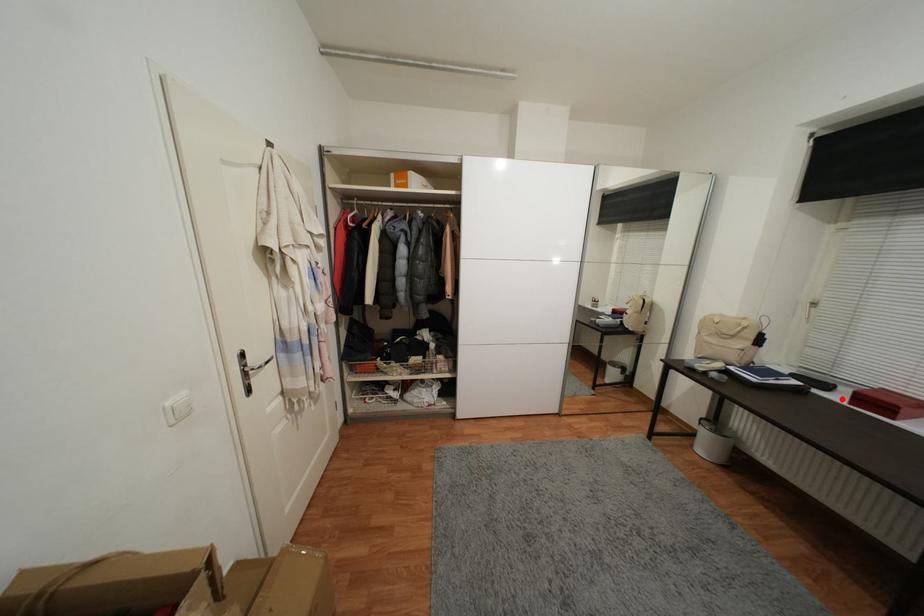
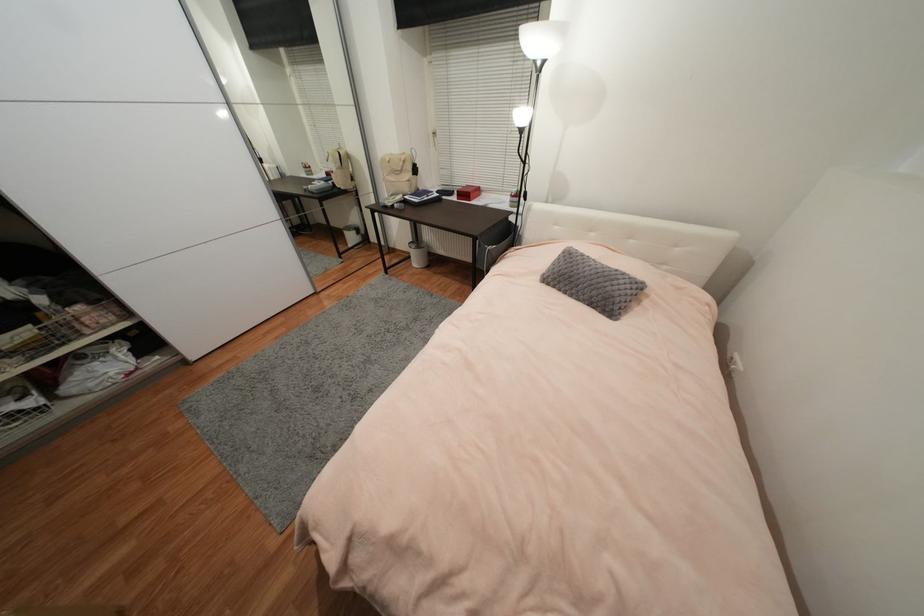
Where in the second image is the point corresponding to the highlighted location from the first image?

(458, 199)